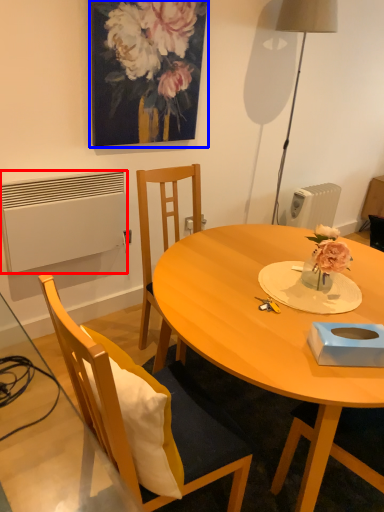
Question: Among these objects, which one is nearest to the camera, radiator (highlighted by a red box) or picture frame (highlighted by a blue box)?

Choices:
 (A) radiator
 (B) picture frame

Answer: (B)